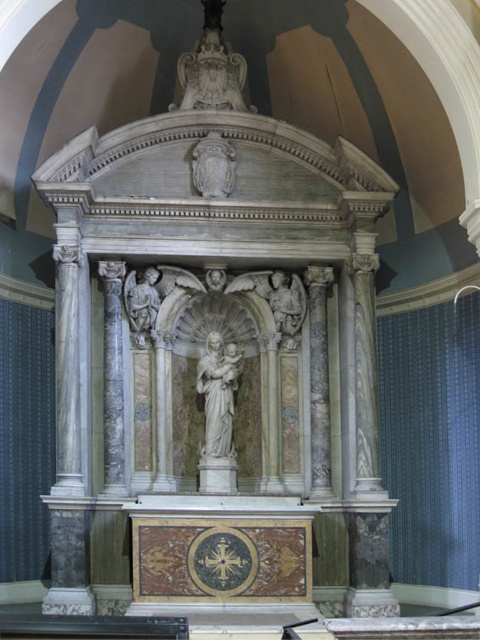
You are an architect analyzing the spatial layout of the altar. Given that the white marble statue at upper center is positioned at coordinates 0.108 on the x and 0.442 on the y, can you determine its central location relative to the altar?

The white marble statue at upper center is located at point 0.108 on the x and 0.442 on the y, which places it centrally within the altar structure based on the given coordinates.

In the scene shown: You are an art conservator assessing the altar. You need to determine which object is more prominent in the central area of the altar between the white marble statue at upper center and the white marble coat of arms at upper center. Based on their sizes, which one should you prioritize for conservation first?

The white marble statue at upper center has a larger size compared to the white marble coat of arms at upper center, so it should be prioritized for conservation first due to its prominence.

You are an architect designing a scale model of this altar. The model will be 1 foot in height. If the actual distance between the white marble statue at upper center and the white marble angel at upper left is 64.54 feet, how far apart should you place them in the model?

The actual distance between the white marble statue at upper center and the white marble angel at upper left is 64.54 feet. In the model, which is 1 foot tall, the distance should be scaled down proportionally. However, without knowing the scale of the model relative to the actual altar, it is impossible to determine the exact distance in the model. Please provide the scale factor or the actual height of the altar to calculate the correct distance.